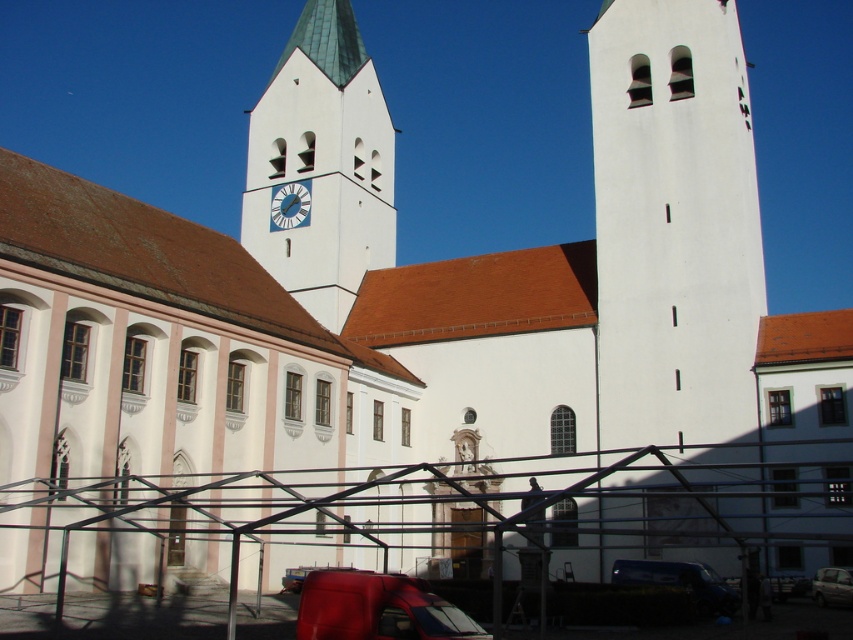
Question: Which of the following is the closest to the observer?

Choices:
 (A) (x=374, y=228)
 (B) (x=374, y=605)
 (C) (x=705, y=588)

Answer: (B)

Question: Where is white smooth clock tower at center located in relation to metallic clock face at center in the image?

Choices:
 (A) above
 (B) below

Answer: (A)

Question: Is white smooth clock tower at center to the left of matte red van at lower center from the viewer's perspective?

Choices:
 (A) no
 (B) yes

Answer: (B)

Question: In this image, where is white smooth clock tower at center located relative to metallic clock face at center?

Choices:
 (A) below
 (B) above

Answer: (B)

Question: Among these points, which one is farthest from the camera?

Choices:
 (A) (689, 74)
 (B) (281, 244)
 (C) (705, 612)
 (D) (276, 186)

Answer: (D)

Question: Among these points, which one is farthest from the camera?

Choices:
 (A) (709, 204)
 (B) (277, 202)
 (C) (686, 572)
 (D) (328, 115)

Answer: (D)